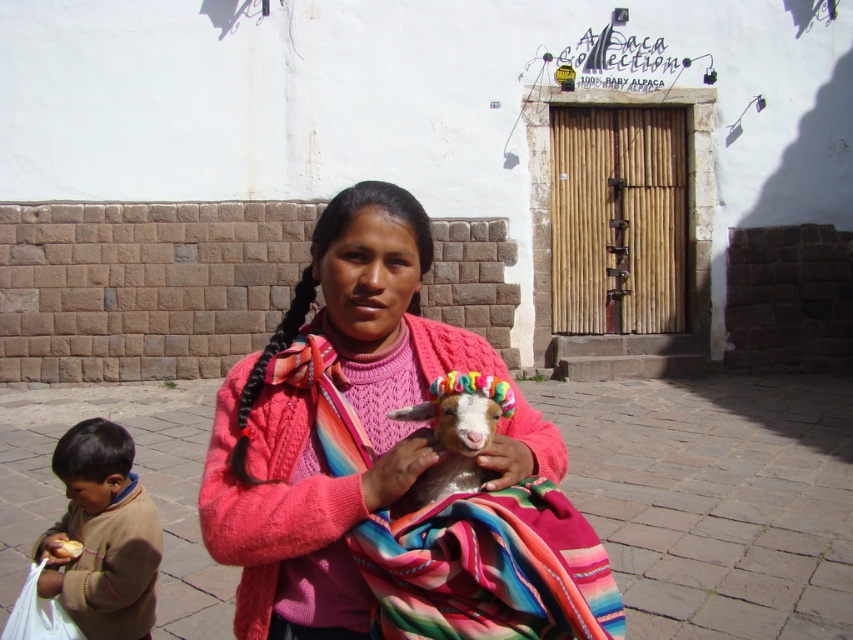
Is brown wool sweater at lower left wider than black silky pigtail at center?

No.

Does brown wool sweater at lower left appear under black silky pigtail at center?

Yes, brown wool sweater at lower left is below black silky pigtail at center.

Does point (74, 618) come behind point (283, 342)?

Yes, it is.

Image resolution: width=853 pixels, height=640 pixels. What are the coordinates of `brown wool sweater at lower left` in the screenshot? It's located at (102, 536).

Can you confirm if multicolored woven blanket at center is smaller than white woolen goat at center?

No.

In the scene shown: Between multicolored woven blanket at center and white woolen goat at center, which one appears on the left side from the viewer's perspective?

Positioned to the left is white woolen goat at center.

I want to click on multicolored woven blanket at center, so click(488, 568).

Between pink knitted sweater at center and black silky pigtail at center, which one is positioned higher?

black silky pigtail at center is above.

Does pink knitted sweater at center have a larger size compared to black silky pigtail at center?

No, pink knitted sweater at center is not bigger than black silky pigtail at center.

Image resolution: width=853 pixels, height=640 pixels. What do you see at coordinates (312, 428) in the screenshot?
I see `pink knitted sweater at center` at bounding box center [312, 428].

You are a GUI agent. You are given a task and a screenshot of the screen. Output one action in this format:
    pyautogui.click(x=<x>, y=<y>)
    Task: Click on the pink knitted sweater at center
    The height and width of the screenshot is (640, 853).
    Given the screenshot: What is the action you would take?
    pyautogui.click(x=312, y=428)